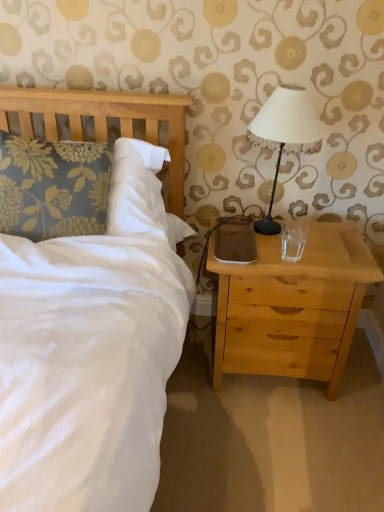
Locate an element on the screen. Image resolution: width=384 pixels, height=512 pixels. vacant area that is situated to the right of white fabric-covered lampshade at upper right is located at coordinates (334, 237).